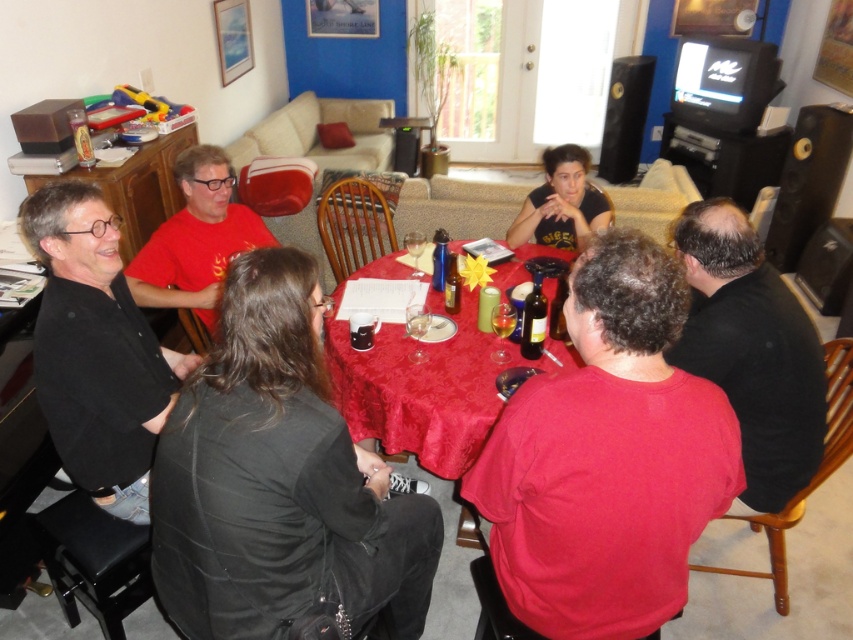
You are a guest at this gathering and want to place a small note on the table without blocking the dark glass bottle at center. Where should you place it to ensure it doesn t interfere with the black matte shirt at right?

The black matte shirt at right is bigger than the dark glass bottle at center, so placing the note near the dark glass bottle at center would avoid interference with the larger black matte shirt at right.

Looking at this image, you are a photographer setting up a shoot in this room. You need to position a light source so that it illuminates the matte black shirt at left and the dark glass bottle at center equally. Given their heights, which object should be placed closer to the light source to achieve even lighting?

The matte black shirt at left is taller than the dark glass bottle at center, so to achieve even lighting, the dark glass bottle at center should be placed closer to the light source since it is shorter and requires less distance to receive the same amount of light.

You are a photographer trying to capture a candid shot of the matte black shirt at left and the dark glass bottle at center. If your camera can only focus on objects wider than 15 cm, will both objects be in focus?

The matte black shirt at left might be wider than dark glass bottle at center. Since the camera focuses on objects wider than 15 cm, the matte black shirt at left may qualify, but the dark glass bottle at center might not. However, without exact measurements, it is uncertain if both will be in focus.